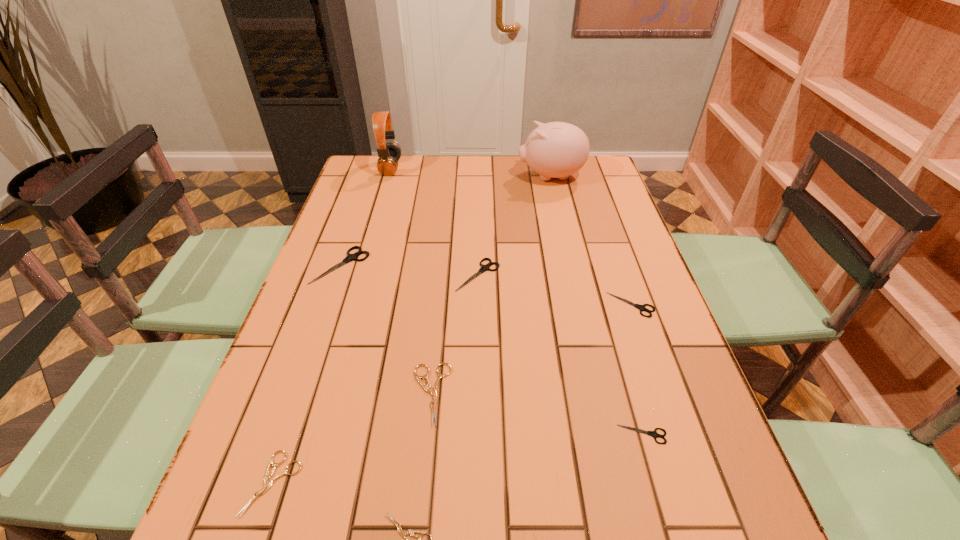
At what (x,y) coordinates should I click in order to perform the action: click on the fourth closest object relative to the second smallest beige shears. Please return your answer as a coordinate pair (x, y). This screenshot has width=960, height=540. Looking at the image, I should click on (486, 267).

Identify the location of shears object that ranks as the fourth closest to the nearest black shears. Image resolution: width=960 pixels, height=540 pixels. point(486,267).

Identify which shears is located as the third nearest to the headset. Please provide its 2D coordinates. Your answer should be formatted as a tuple, i.e. [(x, y)], where the tuple contains the x and y coordinates of a point satisfying the conditions above.

[(434, 391)]

Choose which black shears is the third nearest neighbor to the piggy bank. Please provide its 2D coordinates. Your answer should be formatted as a tuple, i.e. [(x, y)], where the tuple contains the x and y coordinates of a point satisfying the conditions above.

[(350, 257)]

Identify which black shears is the closest to the shortest object. Please provide its 2D coordinates. Your answer should be formatted as a tuple, i.e. [(x, y)], where the tuple contains the x and y coordinates of a point satisfying the conditions above.

[(654, 434)]

Locate an element on the screen. This screenshot has height=540, width=960. beige shears that stands as the closest to the second smallest black shears is located at coordinates (434, 391).

Choose which beige shears is the third nearest neighbor to the third smallest black shears. Please provide its 2D coordinates. Your answer should be formatted as a tuple, i.e. [(x, y)], where the tuple contains the x and y coordinates of a point satisfying the conditions above.

[(405, 534)]

Find the location of a particular element. vacant area in the image that satisfies the following two spatial constraints: 1. on the ear cups of the smallest black shears; 2. on the right side of the brown headset is located at coordinates (312, 434).

Identify the location of free space that satisfies the following two spatial constraints: 1. on the ear cups of the smallest black shears; 2. on the right side of the brown headset. (312, 434).

I want to click on free spot that satisfies the following two spatial constraints: 1. on the ear cups of the brown headset; 2. on the front side of the leftmost beige shears, so click(298, 483).